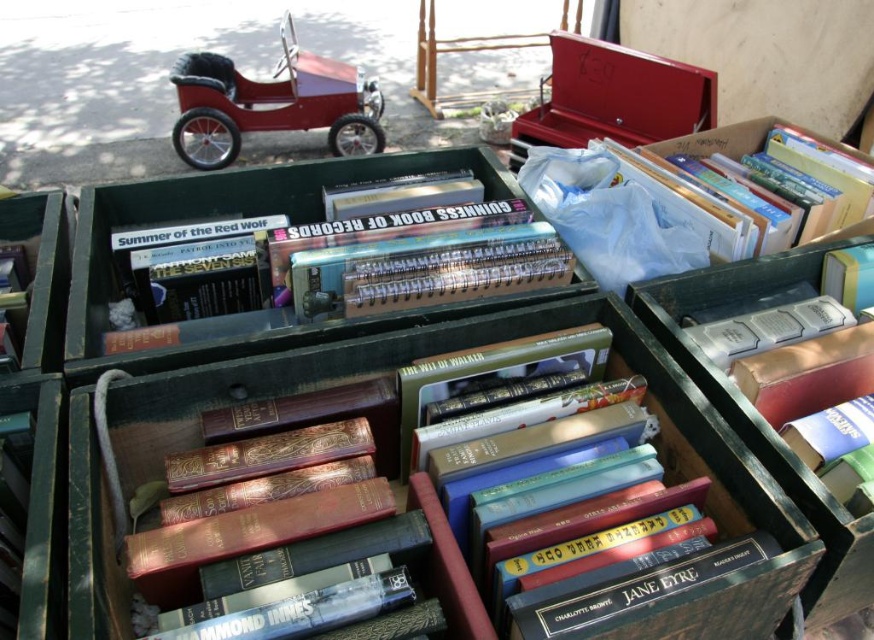
Does shiny red toy car at upper left have a greater width compared to white plastic bag at upper right?

Yes, shiny red toy car at upper left is wider than white plastic bag at upper right.

Which is behind, point (286, 49) or point (704, 205)?

The point (286, 49) is behind.

Between point (238, 125) and point (753, 145), which one is positioned in front?

Positioned in front is point (753, 145).

What are the coordinates of `shiny red toy car at upper left` in the screenshot? It's located at (272, 104).